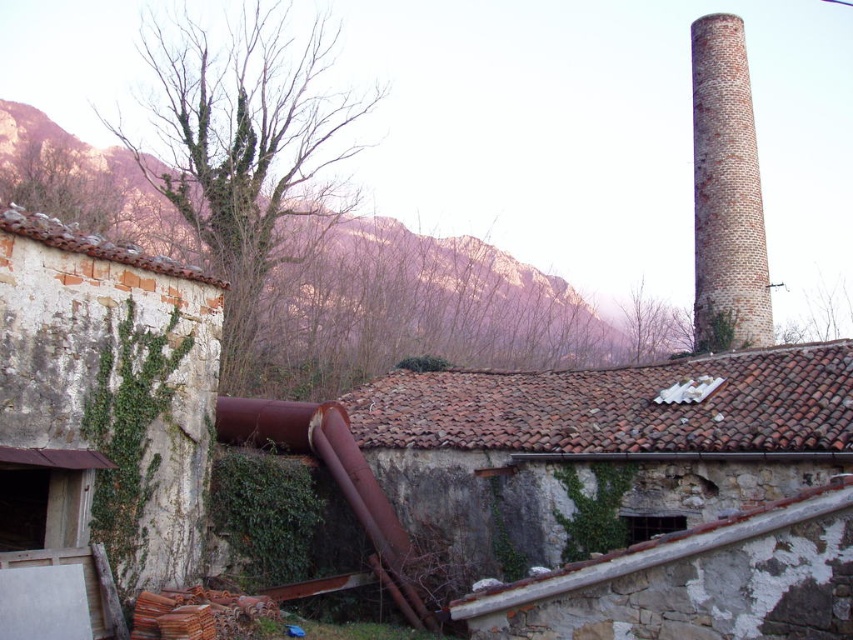
You are standing in front of the old industrial building and need to locate both the brown rocky mountain at upper left and the rusty metal pipe at lower center. From your position, which object is positioned to the left of the other?

The brown rocky mountain at upper left is to the left of the rusty metal pipe at lower center.

You are a hiker who wants to take a photo of the brown rocky mountain at upper left and the rusty metal pipe at lower center. Which object should you focus on first if you want to capture both in a single frame without moving your camera?

The brown rocky mountain at upper left is larger in size compared to the rusty metal pipe at lower center, so you should focus on the brown rocky mountain at upper left first to ensure it fits properly in the frame.

You are a drone operator trying to fly a drone from the rusty metal pipe at lower center to the brown rocky mountain at upper left. Considering the spatial relationship between them, can the drone ascend directly without any obstacles?

The brown rocky mountain at upper left is taller than the rusty metal pipe at lower center, so the drone can ascend directly to it as there are no mentioned obstacles between them.